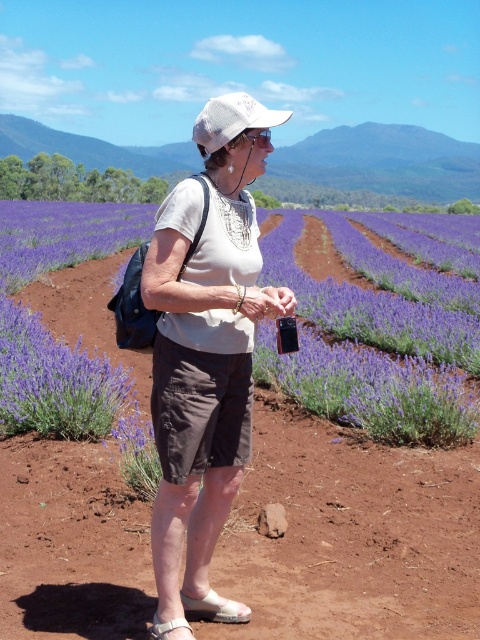
You are standing at the point where the person is in the image. You want to place a matte white hat exactly where the person is currently standing. Is the point where the person is standing the same as the point marked as point (205,353)?

Yes, the point where the person is standing is the same as point (205,353), so placing the matte white hat there would be accurate.

You are standing in the lavender field and want to take a photo of both the point at coordinates point (219,449) and the point at coordinates point (242,116). Since the camera can only focus on one point at a time, which point should you focus on first to ensure both points are in the frame?

You should focus on point (219,449) first because it is closer to the camera than point (242,116). This way, adjusting the focus to include both points becomes easier as the farther point will naturally fall into the depth of field once the closer one is sharp.